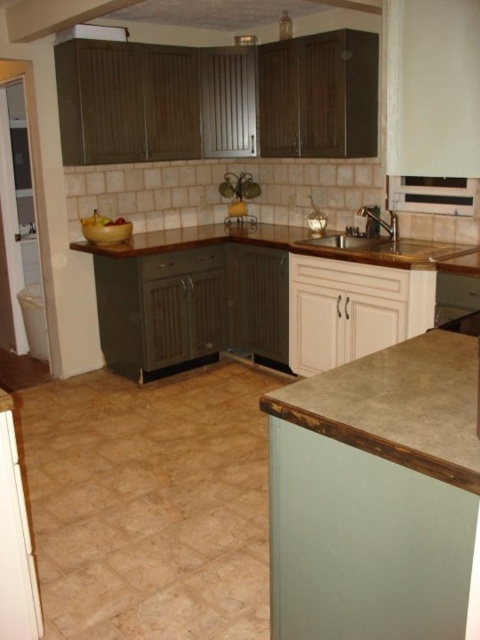
You are a chef preparing a meal and need to place a heavy pot on the counter. Which of the two countertops, the concrete textured countertop at lower right or the brown laminate counter top at center, is more suitable for supporting the pot?

The brown laminate counter top at center is more suitable for supporting the pot because it is thicker than the concrete textured countertop at lower right, providing better structural support.

You are a delivery person placing a 6 feet long package in the kitchen. You see the concrete textured countertop at lower right and the brown laminate counter top at center. Can you fit the package horizontally between them?

The distance between the concrete textured countertop at lower right and the brown laminate counter top at center is 5.72 feet. Since the package is 6 feet long, it cannot fit horizontally between them as the space is shorter than the package.